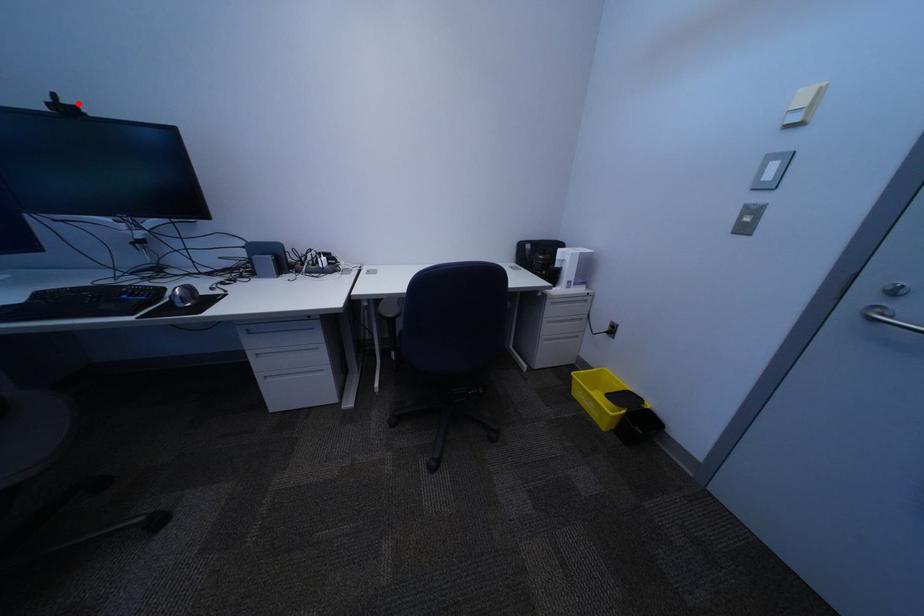
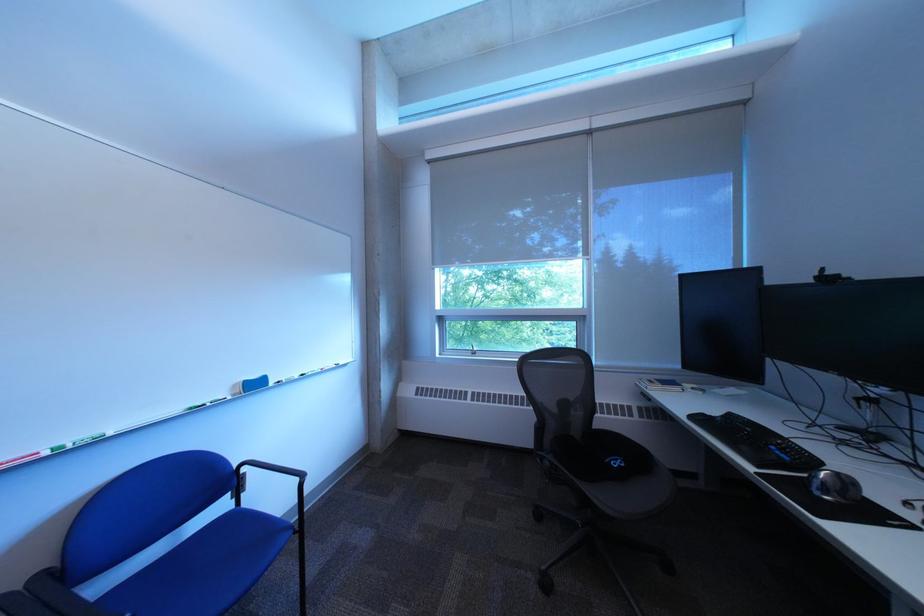
Where in the second image is the point corresponding to the highlighted location from the first image?

(843, 275)